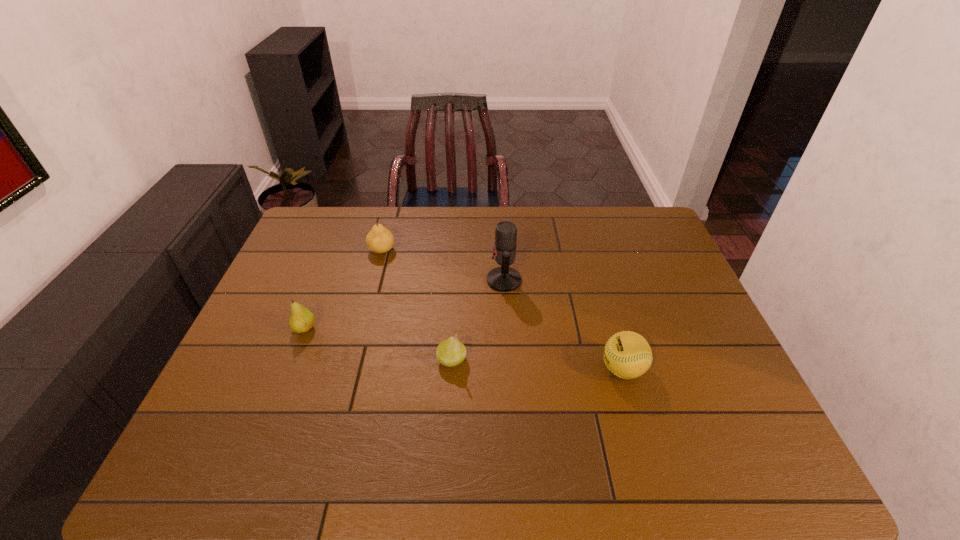
Identify the location of vacant space at the far edge of the desktop. (571, 220).

The width and height of the screenshot is (960, 540). In order to click on blank space at the left edge in this screenshot , I will do `click(311, 294)`.

In the image, there is a desktop. Identify the location of vacant space at the right edge. (684, 295).

Locate an element on the screen. Image resolution: width=960 pixels, height=540 pixels. vacant space at the near right corner of the desktop is located at coordinates (746, 481).

This screenshot has height=540, width=960. In order to click on empty location between the farthest object and the leftmost pear in this screenshot , I will do `click(344, 289)`.

I want to click on unoccupied area between the farthest object and the tallest object, so click(443, 265).

The height and width of the screenshot is (540, 960). Identify the location of free space between the third object from left to right and the rightmost object. (538, 364).

This screenshot has height=540, width=960. I want to click on unoccupied area between the farthest pear and the rightmost pear, so click(x=417, y=305).

The image size is (960, 540). What are the coordinates of `free space between the second farthest object and the softball` in the screenshot? It's located at (564, 325).

I want to click on vacant space that is in between the softball and the farthest object, so click(x=502, y=309).